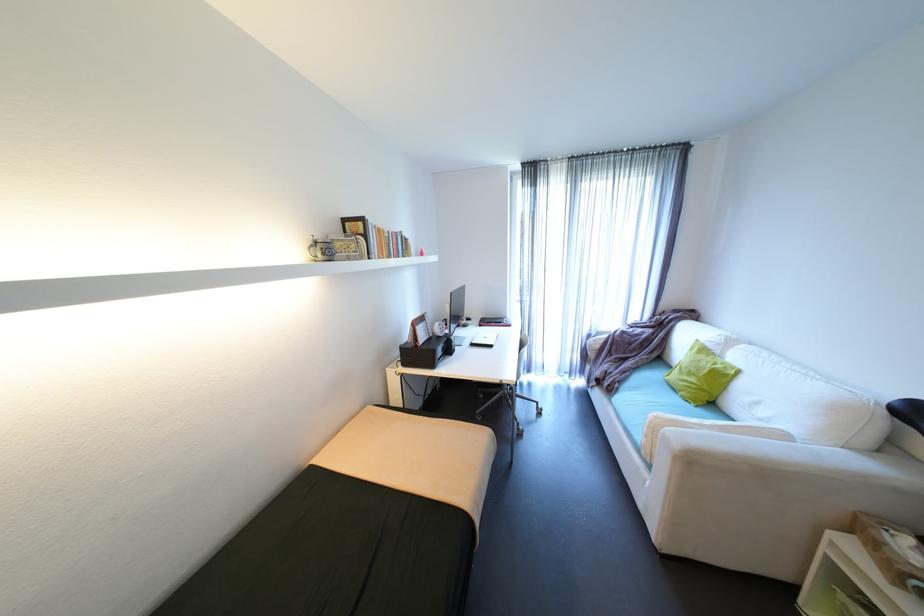
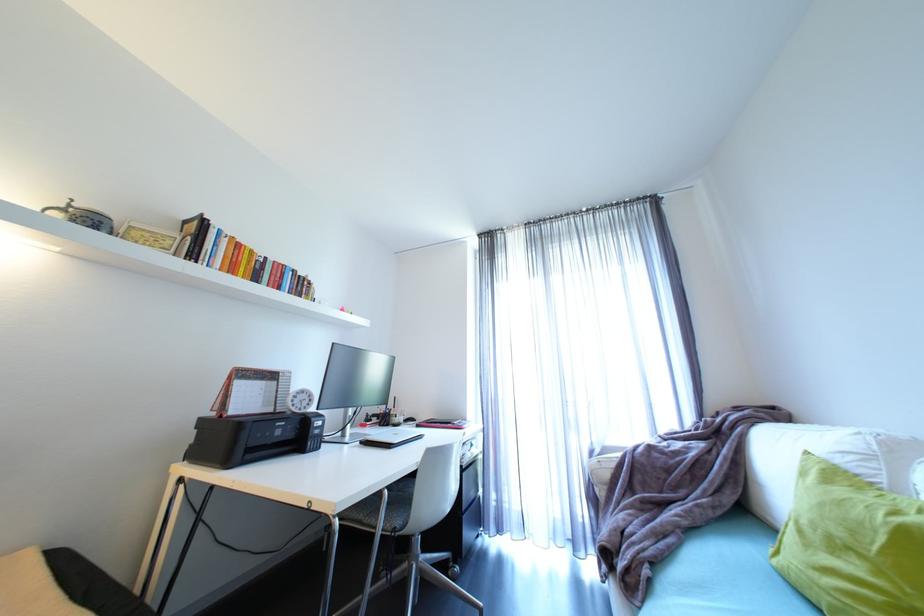
In the second image, find the point that corresponds to point (496, 323) in the first image.

(440, 424)